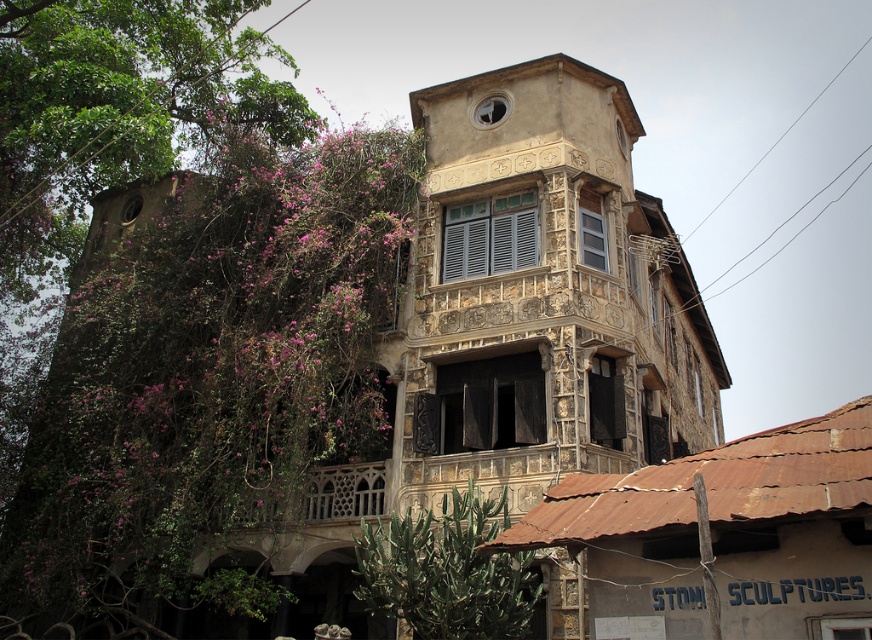
Is green leafy tree at left thinner than green leafy plant at lower center?

In fact, green leafy tree at left might be wider than green leafy plant at lower center.

Looking at this image, does green leafy tree at left have a lesser height compared to green leafy plant at lower center?

No, green leafy tree at left is not shorter than green leafy plant at lower center.

Between point (113, 524) and point (489, 516), which one is positioned behind?

The point (113, 524) is behind.

At what (x,y) coordinates should I click in order to perform the action: click on green leafy tree at left. Please return your answer as a coordinate pair (x, y). This screenshot has width=872, height=640. Looking at the image, I should click on (208, 378).

Which of these two, green leafy tree at left or carved stone balcony at center, stands taller?

green leafy tree at left is taller.

Where is `green leafy tree at left`? green leafy tree at left is located at coordinates (208, 378).

Which is more to the right, green leafy plant at lower center or carved stone balcony at center?

green leafy plant at lower center is more to the right.

Describe the element at coordinates (447, 572) in the screenshot. I see `green leafy plant at lower center` at that location.

Does point (477, 621) lie in front of point (328, 518)?

Yes, point (477, 621) is in front of point (328, 518).

Find the location of a particular element. This screenshot has width=872, height=640. green leafy plant at lower center is located at coordinates (447, 572).